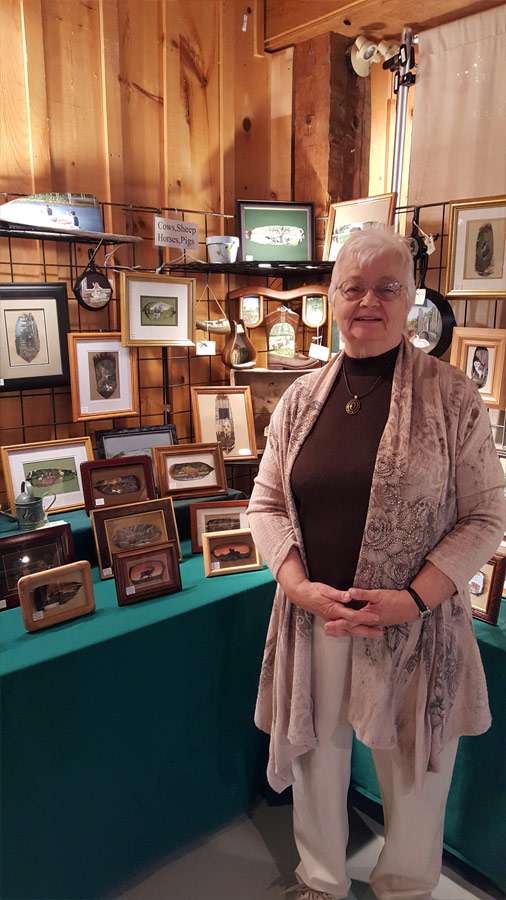
Locate an element on the screen. The height and width of the screenshot is (900, 506). art is located at coordinates (165, 286).